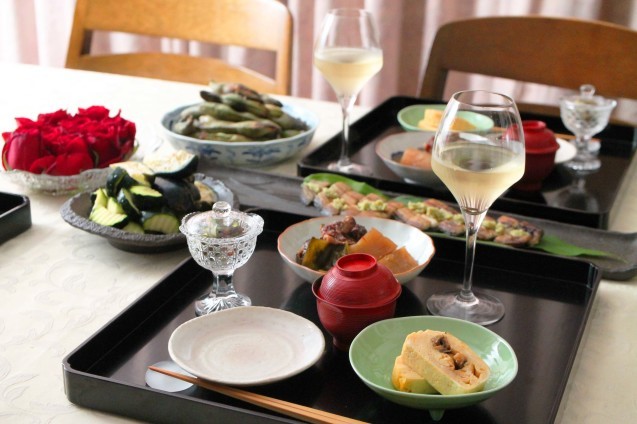
The width and height of the screenshot is (637, 424). What are the coordinates of `red lidded bowls` in the screenshot? It's located at (362, 299), (534, 141).